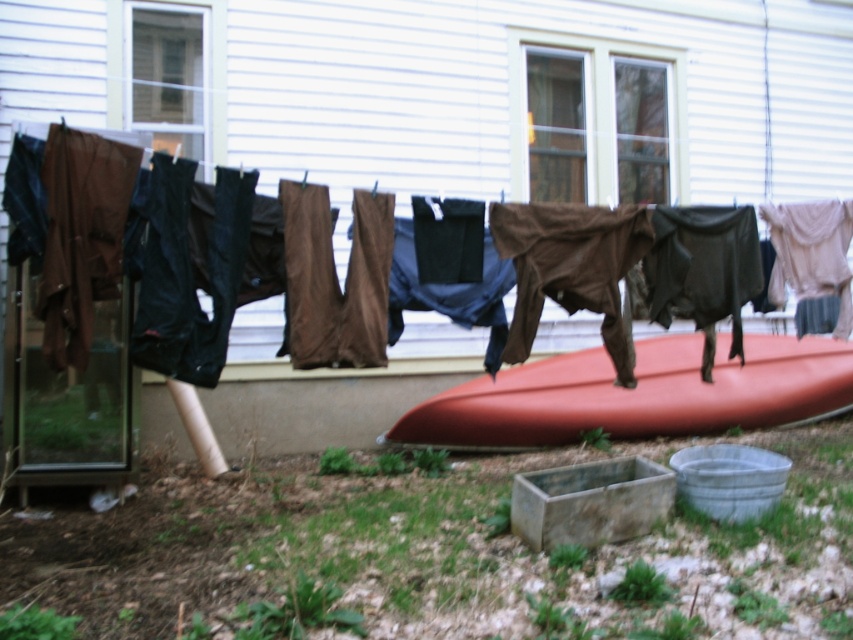
Is point (711, 348) more distant than point (473, 416)?

No, (711, 348) is closer to viewer.

Consider the image. Is matte brown pants at center further to the viewer compared to matte orange kayak at center?

No, it is not.

Between point (84, 364) and point (843, 376), which one is positioned in front?

Positioned in front is point (84, 364).

Find the location of a particular element. matte brown pants at center is located at coordinates (361, 264).